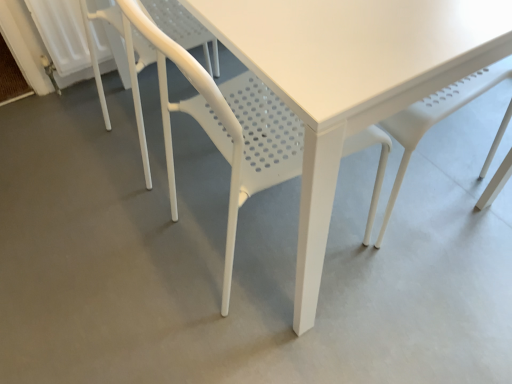
Where is `vacant area that lies to the right of white plastic chair at center, the 1th chair positioned from the right`? vacant area that lies to the right of white plastic chair at center, the 1th chair positioned from the right is located at coordinates (424, 281).